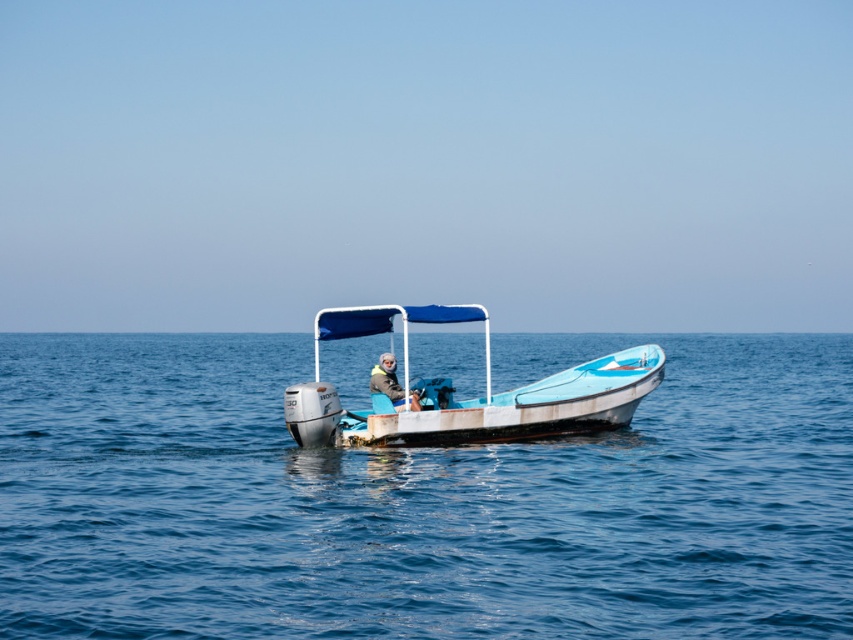
Consider the image. Is blue water at center closer to camera compared to gray knit hat at center?

Yes, blue water at center is in front of gray knit hat at center.

Is point (238, 429) farther from viewer compared to point (380, 388)?

Yes, it is.

Is point (668, 404) farther from viewer compared to point (405, 390)?

That is True.

Locate an element on the screen. blue water at center is located at coordinates (421, 499).

Is point (779, 499) positioned in front of point (587, 408)?

Yes, it is.

Which is behind, point (645, 522) or point (316, 390)?

Point (316, 390)

Is point (433, 481) positioned before point (302, 428)?

Yes, it is.

The image size is (853, 640). Find the location of `blue water at center`. blue water at center is located at coordinates (421, 499).

Is light blue plastic boat at center further to camera compared to gray knit hat at center?

No, light blue plastic boat at center is in front of gray knit hat at center.

Which of these two, light blue plastic boat at center or gray knit hat at center, stands taller?

Standing taller between the two is light blue plastic boat at center.

Who is more distant from viewer, (436,397) or (398,388)?

Positioned behind is point (436,397).

You are a GUI agent. You are given a task and a screenshot of the screen. Output one action in this format:
    pyautogui.click(x=<x>, y=<y>)
    Task: Click on the light blue plastic boat at center
    The width and height of the screenshot is (853, 640).
    Given the screenshot: What is the action you would take?
    pyautogui.click(x=468, y=400)